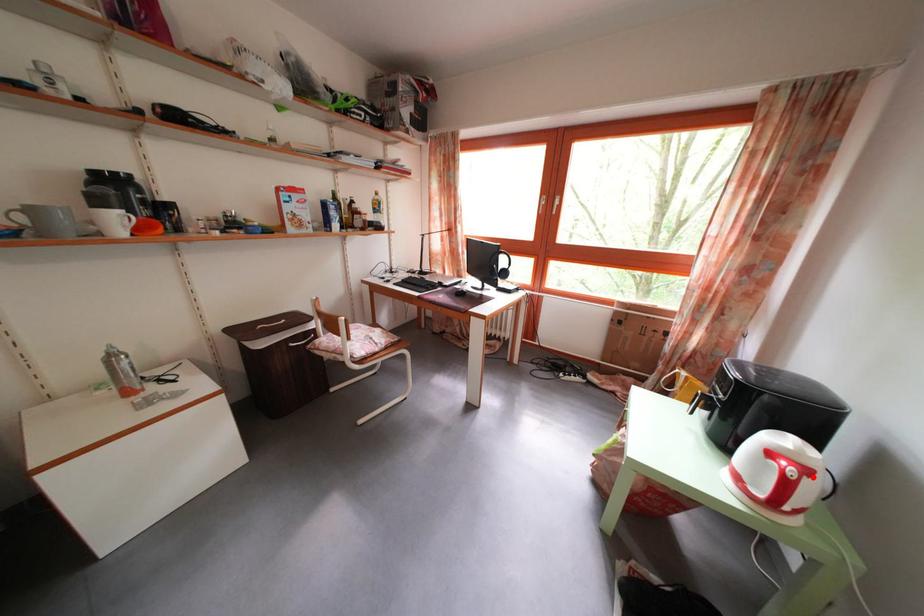
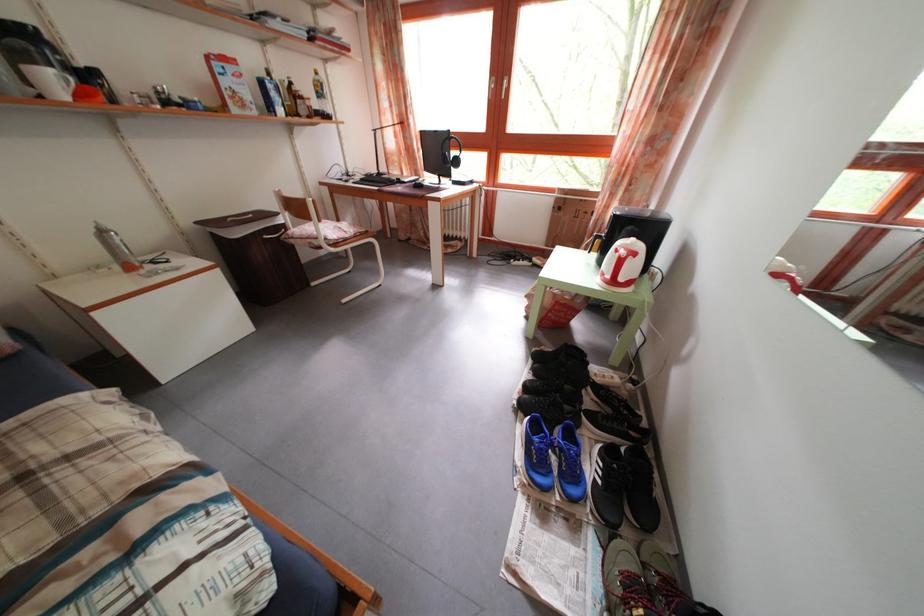
Question: I am providing you with two images of the same scene from different viewpoints. A red point is marked on the first image. At the location where the point appears in image 1, is it still visible in image 2?

Choices:
 (A) Yes
 (B) No

Answer: (A)